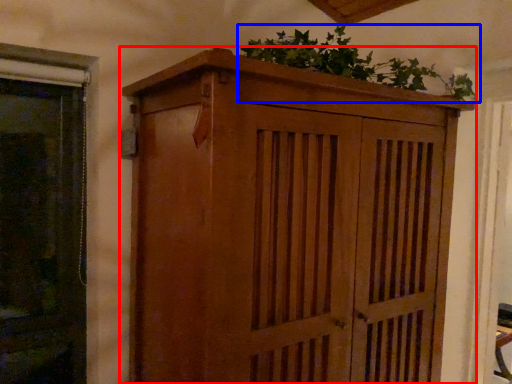
Question: Which point is closer to the camera, cupboard (highlighted by a red box) or houseplant (highlighted by a blue box)?

Choices:
 (A) cupboard
 (B) houseplant

Answer: (A)